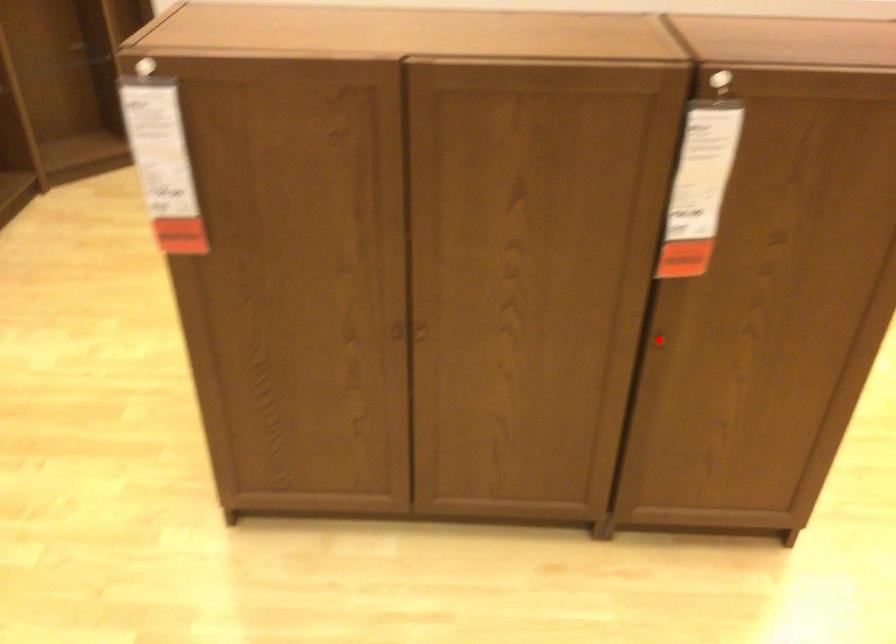
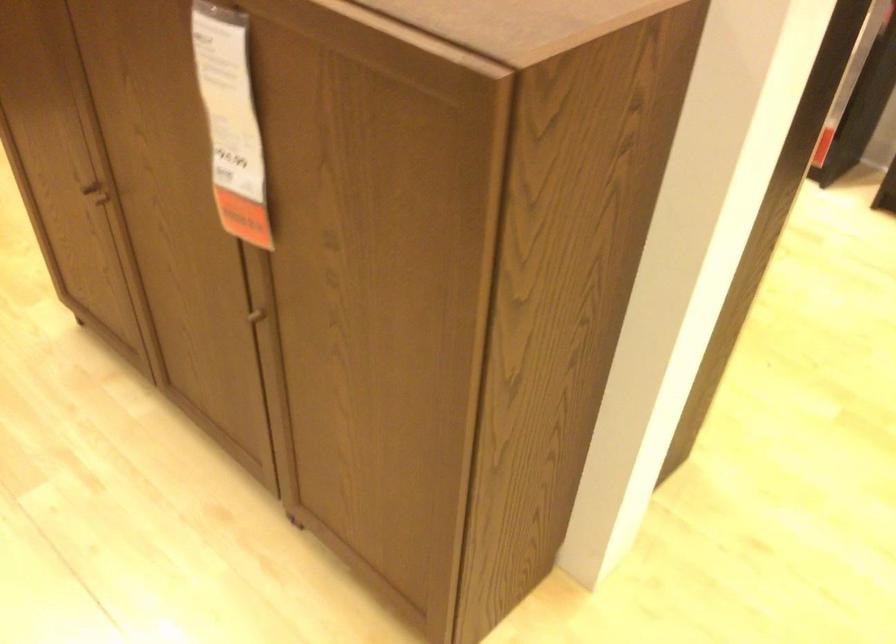
The point at the highlighted location is marked in the first image. Where is the corresponding point in the second image?

(262, 314)